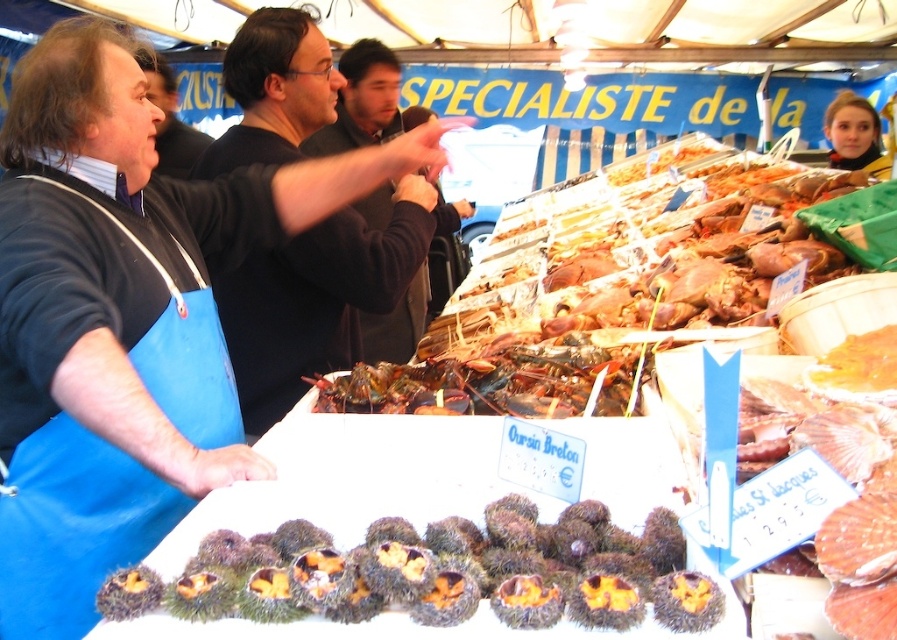
You are a customer at the seafood market and want to know if the brown fuzzy sea urchins at center can fit inside the black sweater at center. Can they fit vertically?

The brown fuzzy sea urchins at center is not as tall as black sweater at center, so they can fit vertically inside the black sweater at center.